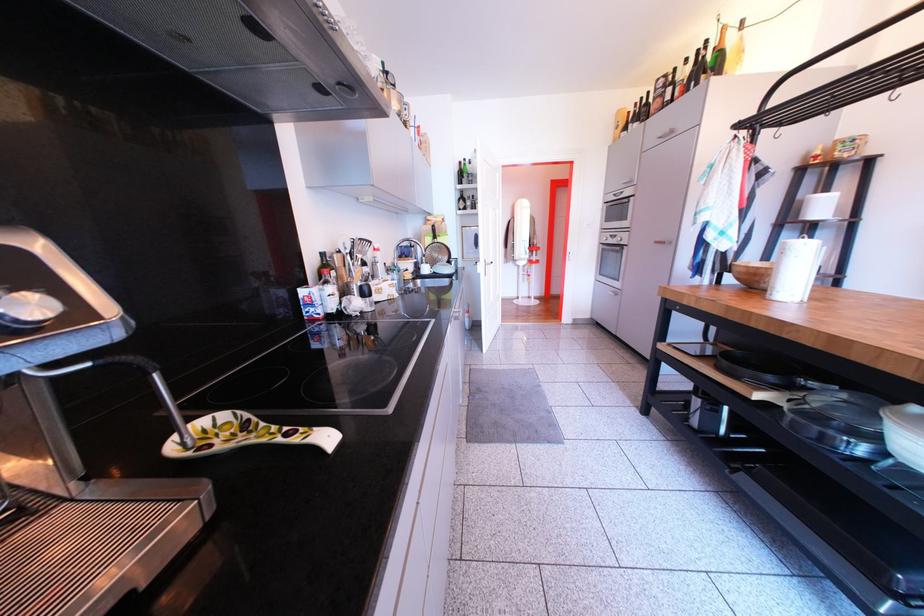
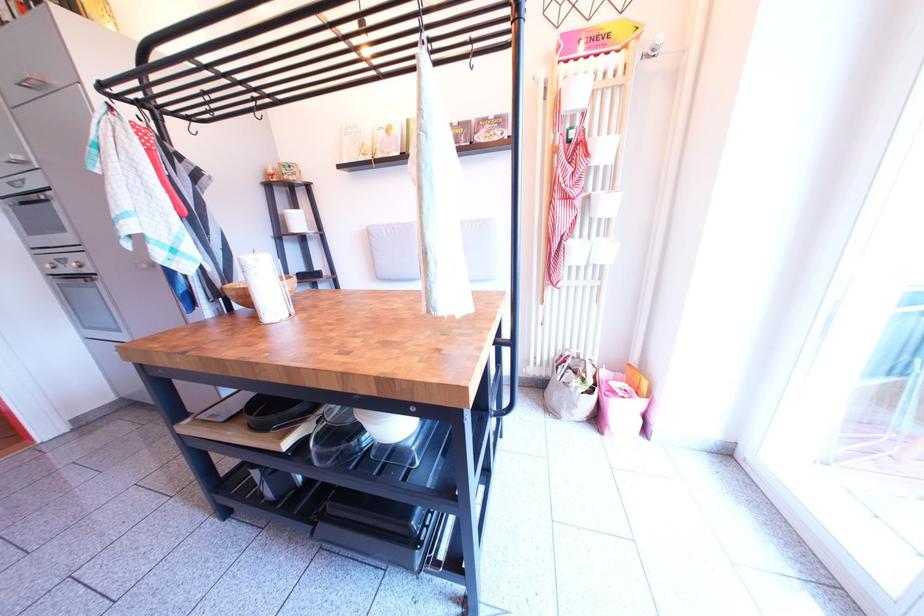
Where in the second image is the point corresponding to point (736, 369) from the first image?

(263, 423)